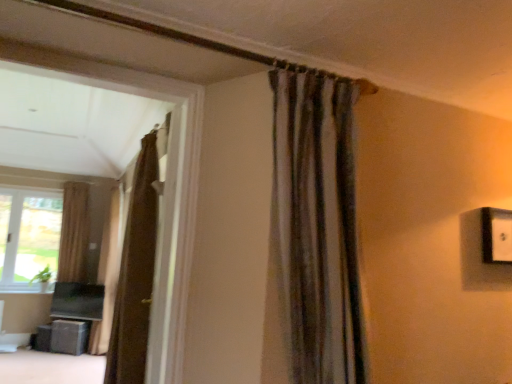
Measure the distance between point (147,354) and camera.

Point (147,354) and camera are 2.62 meters apart from each other.

Describe the element at coordinates (165, 239) in the screenshot. This screenshot has height=384, width=512. I see `transparent plastic screen door at center` at that location.

What is the approximate height of clear glass window at left?

clear glass window at left is 4.72 feet tall.

Measure the distance between point (295,327) and camera.

Point (295,327) is 1.40 meters from camera.

Measure the distance between point (108, 222) and camera.

Point (108, 222) is 6.71 meters from camera.

I want to click on transparent plastic screen door at center, so click(x=165, y=239).

From the image's perspective, is beige fabric curtain at left, which ranks as the fourth curtain in front-to-back order, located above or below brown textured curtain at upper left, which ranks as the 3th curtain in back-to-front order?

Clearly, from the image's perspective, beige fabric curtain at left, which ranks as the fourth curtain in front-to-back order, is below brown textured curtain at upper left, which ranks as the 3th curtain in back-to-front order.

Is point (71, 197) farther from camera compared to point (126, 251)?

Yes, point (71, 197) is farther from viewer.

Which of these two, beige fabric curtain at left, which ranks as the fourth curtain in front-to-back order, or brown textured curtain at upper left, which ranks as the 3th curtain in back-to-front order, stands shorter?

With less height is beige fabric curtain at left, which ranks as the fourth curtain in front-to-back order.

Does matte black speaker at lower left have a greater height compared to brown textured curtain at upper left, which appears as the second curtain when viewed from the right?

No, matte black speaker at lower left is not taller than brown textured curtain at upper left, which appears as the second curtain when viewed from the right.

Would you say brown textured curtain at upper left, which ranks as the 3th curtain in left-to-right order, is part of matte black speaker at lower left's contents?

No, brown textured curtain at upper left, which ranks as the 3th curtain in left-to-right order, is not surrounded by matte black speaker at lower left.

Can you confirm if matte black speaker at lower left is positioned to the left of brown textured curtain at upper left, which ranks as the 3th curtain in left-to-right order?

Yes, matte black speaker at lower left is to the left of brown textured curtain at upper left, which ranks as the 3th curtain in left-to-right order.

From the image's perspective, is beige fabric curtain at left, which ranks as the fourth curtain in front-to-back order, located beneath matte black speaker at lower left?

No.

Consider the image. Based on their sizes in the image, would you say beige fabric curtain at left, which is counted as the first curtain, starting from the left, is bigger or smaller than matte black speaker at lower left?

Considering their sizes, beige fabric curtain at left, which is counted as the first curtain, starting from the left, takes up more space than matte black speaker at lower left.

Image resolution: width=512 pixels, height=384 pixels. Identify the location of furniture in front of the beige fabric curtain at left, acting as the first curtain starting from the back. (62, 337).

Considering the sizes of objects beige fabric curtain at left, which is counted as the first curtain, starting from the left, and transparent plastic screen door at center in the image provided, who is shorter, beige fabric curtain at left, which is counted as the first curtain, starting from the left, or transparent plastic screen door at center?

With less height is transparent plastic screen door at center.

Is beige fabric curtain at left, the 4th curtain in the right-to-left sequence, aimed at transparent plastic screen door at center?

Yes, beige fabric curtain at left, the 4th curtain in the right-to-left sequence, is facing transparent plastic screen door at center.

Looking at their sizes, would you say beige fabric curtain at left, acting as the first curtain starting from the back, is wider or thinner than transparent plastic screen door at center?

Clearly, beige fabric curtain at left, acting as the first curtain starting from the back, has more width compared to transparent plastic screen door at center.

From the picture: From the image's perspective, which is below, beige fabric curtain at left, acting as the first curtain starting from the back, or transparent plastic screen door at center?

beige fabric curtain at left, acting as the first curtain starting from the back, from the image's perspective.

Is point (42, 232) behind point (81, 327)?

That is True.

In the image, there is a matte black speaker at lower left. Where is `window above it (from the image's perspective)`? The width and height of the screenshot is (512, 384). window above it (from the image's perspective) is located at coordinates (29, 238).

From the image's perspective, is clear glass window at left beneath matte black speaker at lower left?

Actually, clear glass window at left appears above matte black speaker at lower left in the image.

Which object is positioned more to the right, clear glass window at left or matte black speaker at lower left?

From the viewer's perspective, matte black speaker at lower left appears more on the right side.

Could you measure the distance between beige fabric curtain at left, acting as the first curtain starting from the back, and clear glass window at left?

beige fabric curtain at left, acting as the first curtain starting from the back, and clear glass window at left are 37.62 centimeters apart.

Is beige fabric curtain at left, acting as the first curtain starting from the back, facing towards clear glass window at left?

No, beige fabric curtain at left, acting as the first curtain starting from the back, is not aimed at clear glass window at left.

From the image's perspective, which is below, beige fabric curtain at left, which ranks as the fourth curtain in front-to-back order, or clear glass window at left?

clear glass window at left, from the image's perspective.

Which object is wider, beige fabric curtain at left, acting as the first curtain starting from the back, or clear glass window at left?

Wider between the two is beige fabric curtain at left, acting as the first curtain starting from the back.

Is transparent plastic screen door at center at the right side of textured gray curtain at upper center, placed as the 4th curtain when sorted from left to right?

No.

Based on the photo, from a real-world perspective, who is located lower, transparent plastic screen door at center or textured gray curtain at upper center, placed as the 1th curtain when sorted from front to back?

transparent plastic screen door at center.

Consider the image. Is transparent plastic screen door at center in front of or behind textured gray curtain at upper center, placed as the 4th curtain when sorted from left to right, in the image?

Clearly, transparent plastic screen door at center is behind textured gray curtain at upper center, placed as the 4th curtain when sorted from left to right.

From the image's perspective, starting from the beige fabric curtain at left, acting as the first curtain starting from the back, which curtain is the 1st one above? Please provide its 2D coordinates.

[(135, 274)]

The height and width of the screenshot is (384, 512). Find the location of `the 2nd curtain in front of the matte black speaker at lower left, counting from the anchor's position`. the 2nd curtain in front of the matte black speaker at lower left, counting from the anchor's position is located at coordinates (135, 274).

Which object lies nearer to the anchor point brown textured curtain at upper left, which appears as the second curtain when viewed from the right, beige fabric curtain at left, which is counted as the first curtain, starting from the left, or clear glass window at left?

Based on the image, clear glass window at left appears to be nearer to brown textured curtain at upper left, which appears as the second curtain when viewed from the right.

From the image, which object appears to be nearer to clear glass window at left, beige fabric curtain at left, which ranks as the fourth curtain in front-to-back order, or brown textured curtain at upper left, which ranks as the 3th curtain in left-to-right order?

beige fabric curtain at left, which ranks as the fourth curtain in front-to-back order, is positioned closer to the anchor clear glass window at left.

Estimate the real-world distances between objects in this image. Which object is further from brown textured curtain at upper left, which appears as the second curtain when viewed from the right, beige fabric curtain at left, acting as the first curtain starting from the back, or brown textured curtain at center, the 2th curtain in the left-to-right sequence?

beige fabric curtain at left, acting as the first curtain starting from the back, is further to brown textured curtain at upper left, which appears as the second curtain when viewed from the right.

Estimate the real-world distances between objects in this image. Which object is further from clear glass window at left, textured gray curtain at upper center, placed as the 4th curtain when sorted from left to right, or brown textured curtain at center, the third curtain viewed from the front?

Among the two, textured gray curtain at upper center, placed as the 4th curtain when sorted from left to right, is located further to clear glass window at left.

From the image, which object appears to be farther from brown textured curtain at center, placed as the second curtain when sorted from back to front, beige fabric curtain at left, acting as the first curtain starting from the back, or textured gray curtain at upper center, which is counted as the 1th curtain, starting from the right?

textured gray curtain at upper center, which is counted as the 1th curtain, starting from the right.

Estimate the real-world distances between objects in this image. Which object is closer to brown textured curtain at upper left, which appears as the second curtain when viewed from the right, clear glass window at left or transparent plastic screen door at center?

The object closer to brown textured curtain at upper left, which appears as the second curtain when viewed from the right, is transparent plastic screen door at center.

Looking at the image, which one is located closer to transparent plastic screen door at center, brown textured curtain at center, the third curtain viewed from the front, or clear glass window at left?

brown textured curtain at center, the third curtain viewed from the front.

When comparing their distances from transparent plastic screen door at center, does brown textured curtain at upper left, which ranks as the 3th curtain in left-to-right order, or textured gray curtain at upper center, positioned as the 4th curtain in back-to-front order, seem closer?

textured gray curtain at upper center, positioned as the 4th curtain in back-to-front order, lies closer to transparent plastic screen door at center than the other object.

At what (x,y) coordinates should I click in order to perform the action: click on furniture located between transparent plastic screen door at center and clear glass window at left in the depth direction. Please return your answer as a coordinate pair (x, y). Looking at the image, I should click on (62, 337).

Image resolution: width=512 pixels, height=384 pixels. Find the location of `curtain between brown textured curtain at upper left, which ranks as the 3th curtain in left-to-right order, and matte black speaker at lower left, along the z-axis`. curtain between brown textured curtain at upper left, which ranks as the 3th curtain in left-to-right order, and matte black speaker at lower left, along the z-axis is located at coordinates (109, 271).

The image size is (512, 384). What are the coordinates of `screen door located between textured gray curtain at upper center, placed as the 4th curtain when sorted from left to right, and brown textured curtain at center, placed as the second curtain when sorted from back to front, in the depth direction` in the screenshot? It's located at (165, 239).

This screenshot has width=512, height=384. I want to click on curtain between beige fabric curtain at left, which ranks as the fourth curtain in front-to-back order, and matte black speaker at lower left vertically, so click(x=109, y=271).